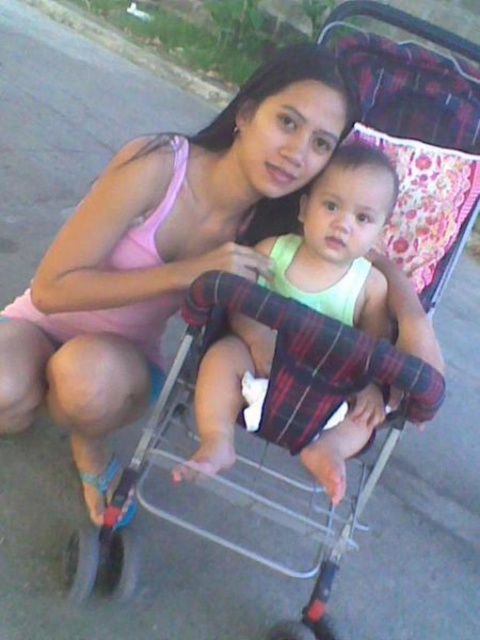
Consider the image. You are a photographer setting up a shot of the woman and baby. You need to position a small prop between the pink fabric at center and the light green fabric baby at center. Where should you place it to ensure it is centered between them?

The pink fabric at center is to the left of the light green fabric baby at center, so place the prop halfway between them along the horizontal axis.

You are a photographer setting up for a family photo. You want to ensure the pink fabric at center and the light green fabric baby at center are in focus. Given that your camera has a depth of field that can cover objects within 8 inches of each other, will both subjects be in focus?

The pink fabric at center is 9.01 inches from the light green fabric baby at center. Since the distance exceeds the camera depth of field of 8 inches, the two subjects will not both be in focus.